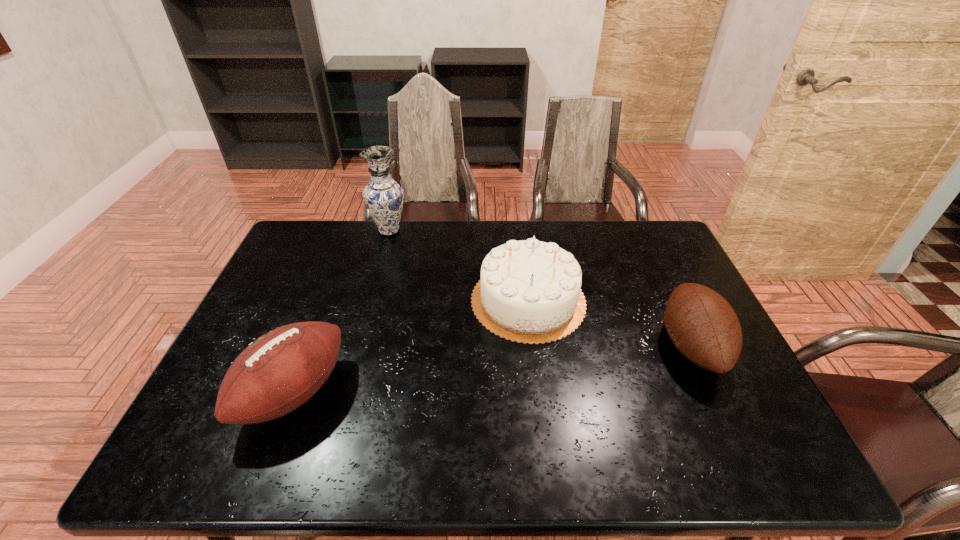
Locate an element on the screen. the farthest object is located at coordinates (383, 196).

Where is `the tallest object`? the tallest object is located at coordinates (383, 196).

The height and width of the screenshot is (540, 960). Identify the location of birthday cake. [530, 291].

The width and height of the screenshot is (960, 540). I want to click on the left football, so click(281, 370).

Where is `the rightmost object`? The width and height of the screenshot is (960, 540). the rightmost object is located at coordinates (703, 326).

At what (x,y) coordinates should I click in order to perform the action: click on vacant region located 0.170m on the right of the vase. Please return your answer as a coordinate pair (x, y). This screenshot has height=540, width=960. Looking at the image, I should click on (456, 231).

Find the location of a particular element. This screenshot has height=540, width=960. free region located 0.380m on the left of the second object from right to left is located at coordinates (343, 300).

The width and height of the screenshot is (960, 540). Identify the location of free location located on the right of the left football. tap(435, 393).

Locate an element on the screen. This screenshot has width=960, height=540. vacant space located on the laces of the right football is located at coordinates (593, 346).

Identify the location of blank space located 0.370m on the laces of the right football. This screenshot has width=960, height=540. (522, 346).